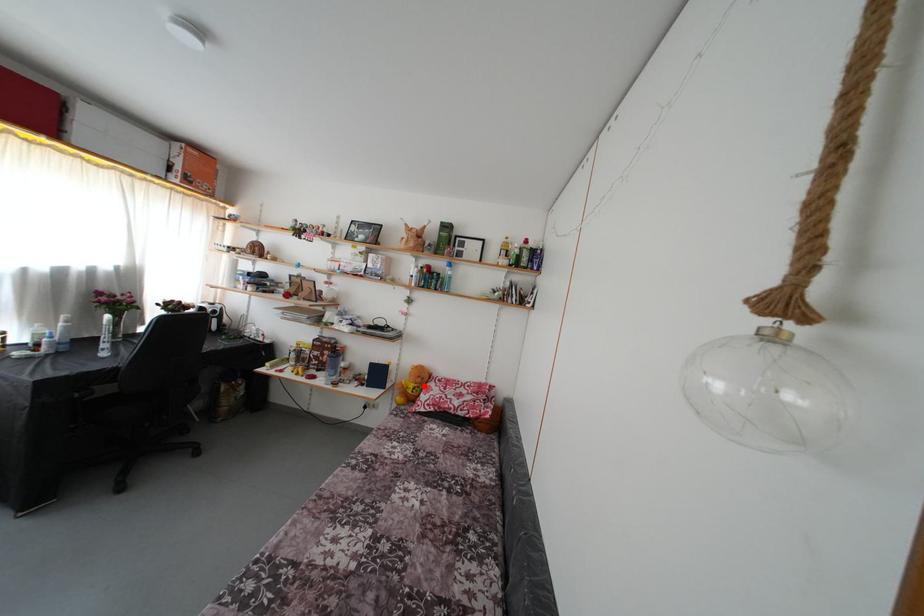
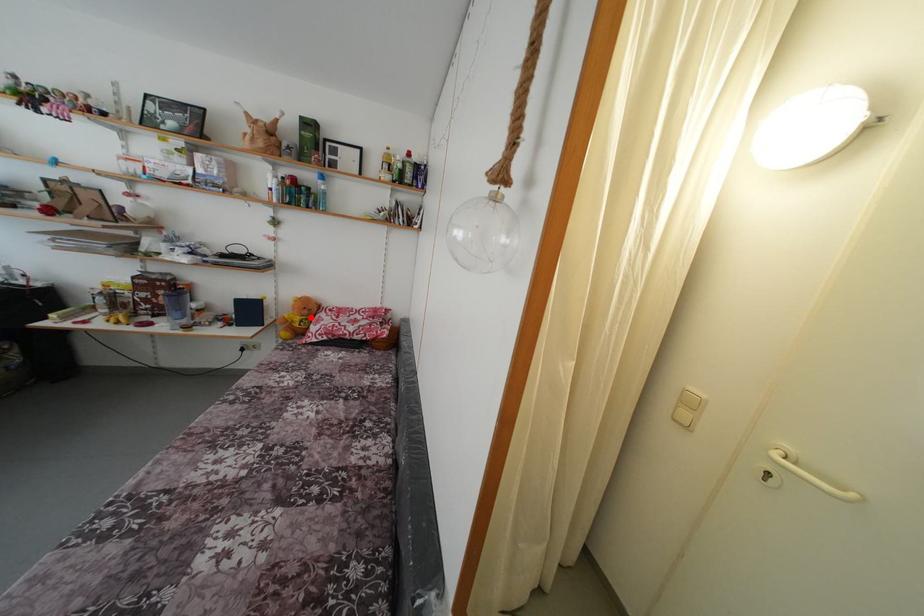
I am providing you with two images of the same scene from different viewpoints. A red point is marked on the first image and another point is marked on the second image. Does the point marked in image1 correspond to the same location as the one in image2?

Yes